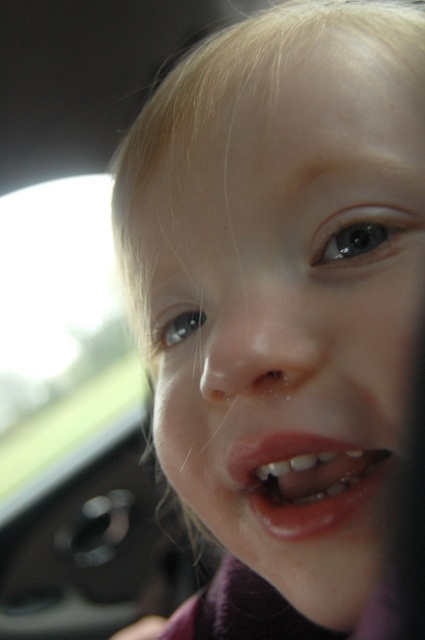
Does smooth skin face at center have a lesser width compared to pink glossy lips at center?

Incorrect, smooth skin face at center's width is not less than pink glossy lips at center's.

Between point (190, 481) and point (351, 481), which one is positioned in front?

Point (351, 481) is more forward.

Identify the location of smooth skin face at center. Image resolution: width=425 pixels, height=640 pixels. (289, 317).